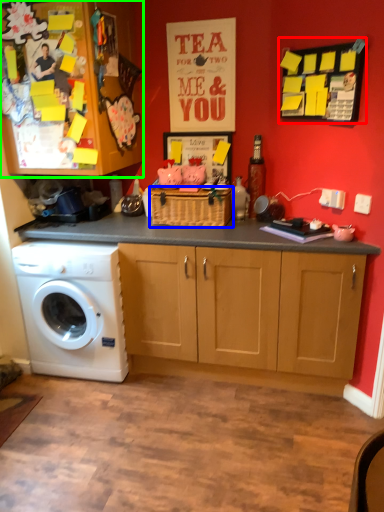
Question: Estimate the real-world distances between objects in this image. Which object is closer to bulletin board (highlighted by a red box), basket (highlighted by a blue box) or cabinetry (highlighted by a green box)?

Choices:
 (A) basket
 (B) cabinetry

Answer: (A)